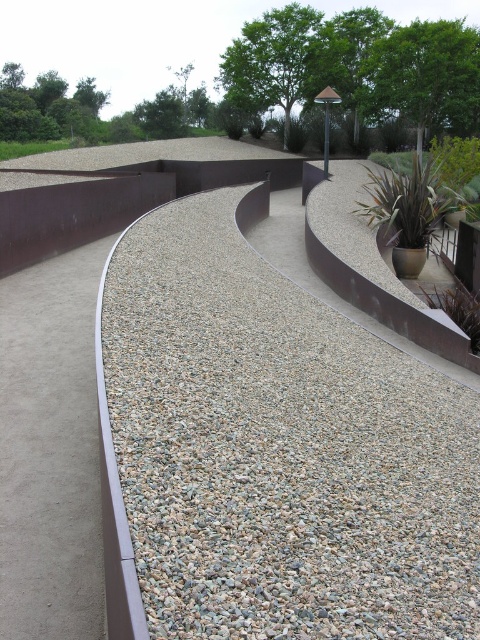
You are a gardener who needs to determine which object is taller between the gray gravel at center and the green leafy plant at upper left. Which one is taller?

The green leafy plant at upper left is taller than the gray gravel at center.

Consider the image. You are designing a garden layout and need to know the relative sizes of the materials in the scene. Which object is smaller in size between the gray gravel at center and the green leafy plant at upper left?

The gray gravel at center has a smaller size compared to the green leafy plant at upper left, so the gray gravel at center is smaller.